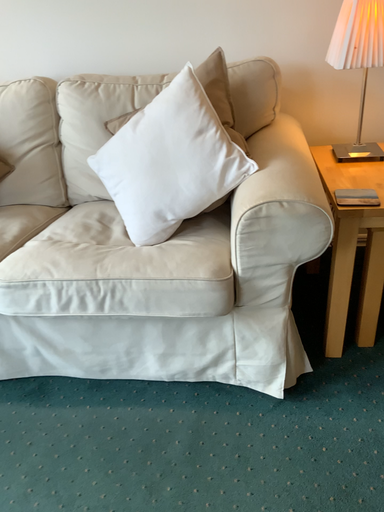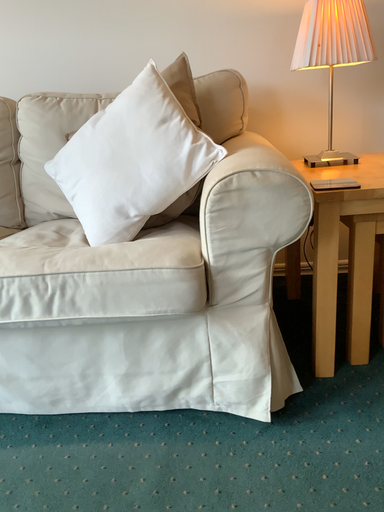
Question: How did the camera likely rotate when shooting the video?

Choices:
 (A) rotated downward
 (B) rotated upward

Answer: (B)